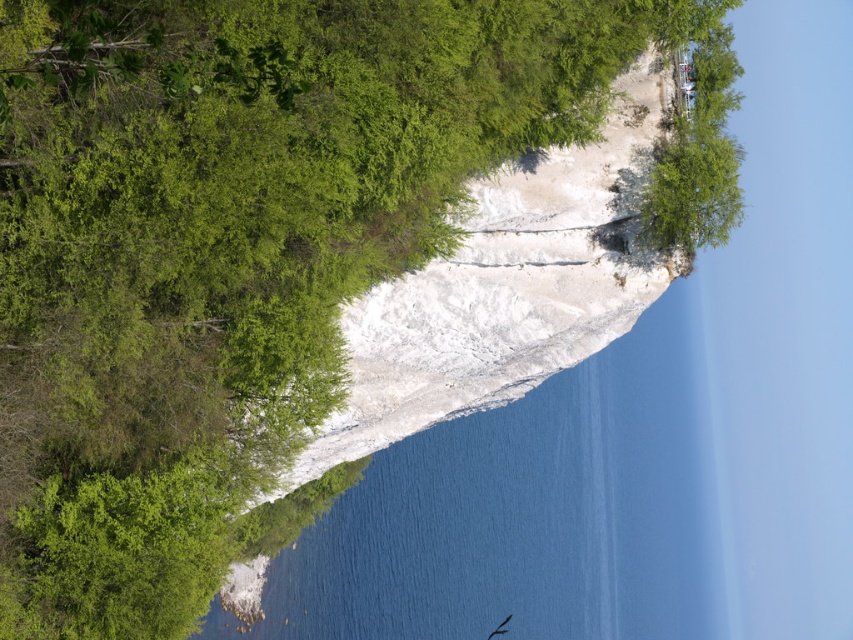
Who is higher up, clear blue water at center or green leafy tree at upper right?

green leafy tree at upper right is higher up.

Who is more distant from viewer, (701, 621) or (688, 132)?

The point (701, 621) is behind.

Who is more forward, (431, 618) or (701, 150)?

Positioned in front is point (701, 150).

Where is `clear blue water at center`? This screenshot has width=853, height=640. clear blue water at center is located at coordinates (527, 513).

Does green leafy tree at upper right appear on the right side of smooth feathered bird at lower center?

Correct, you'll find green leafy tree at upper right to the right of smooth feathered bird at lower center.

Is point (670, 36) farther from viewer compared to point (500, 627)?

No, it is not.

Find the location of a particular element. This screenshot has width=853, height=640. green leafy tree at upper right is located at coordinates (695, 136).

Who is lower down, clear blue water at center or smooth feathered bird at lower center?

smooth feathered bird at lower center

Can you confirm if clear blue water at center is thinner than smooth feathered bird at lower center?

No.

What do you see at coordinates (527, 513) in the screenshot?
I see `clear blue water at center` at bounding box center [527, 513].

Where is `clear blue water at center`? The image size is (853, 640). clear blue water at center is located at coordinates (527, 513).